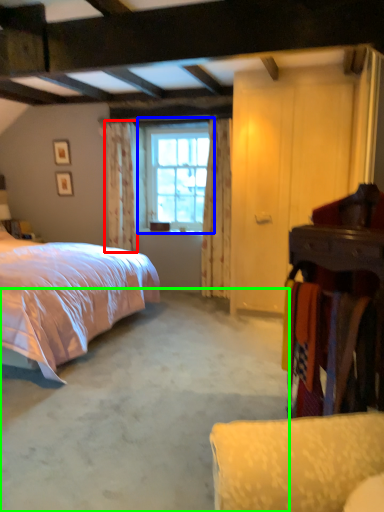
Question: Which is farther away from curtain (highlighted by a red box)? window (highlighted by a blue box) or concrete (highlighted by a green box)?

Choices:
 (A) window
 (B) concrete

Answer: (B)